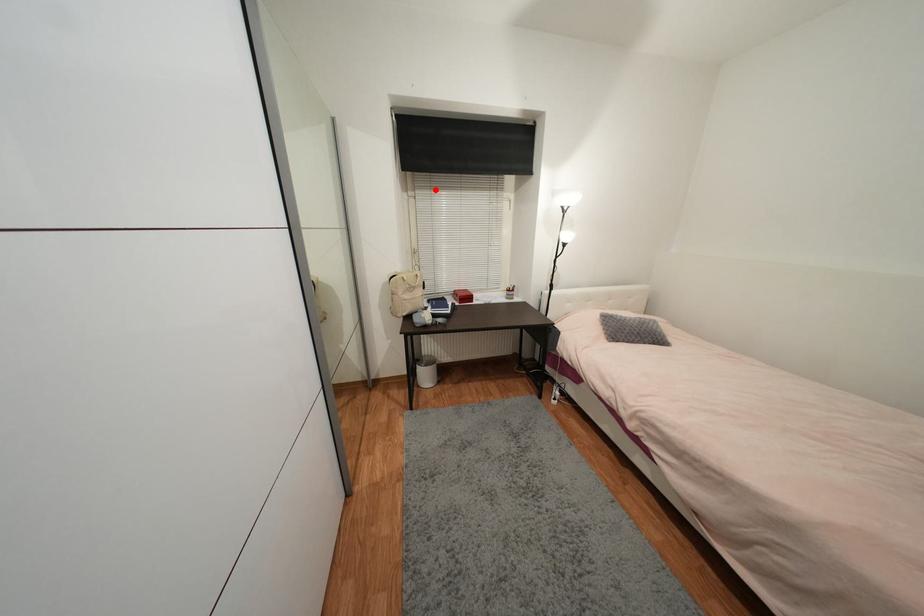
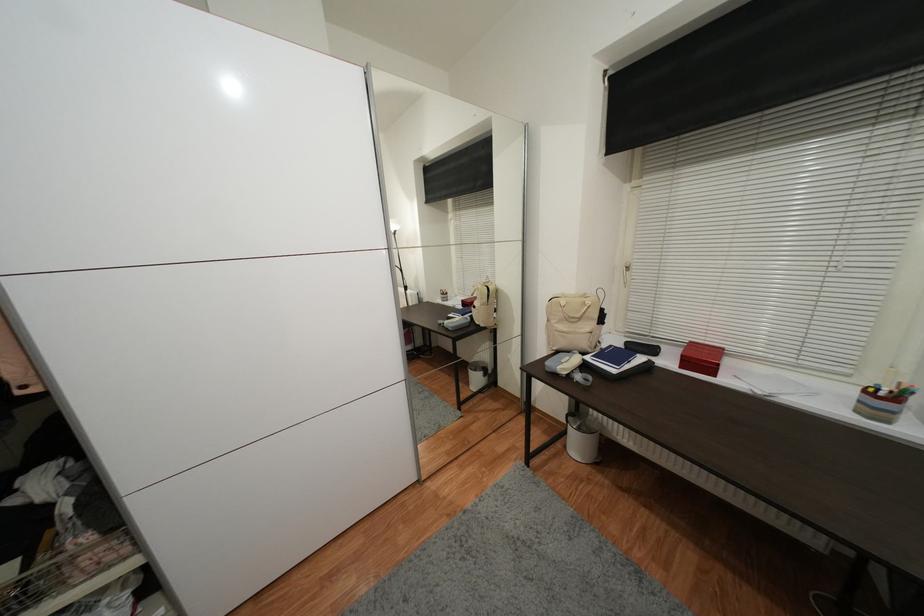
Find the pixel in the second image that matches the highlighted location in the first image.

(678, 167)